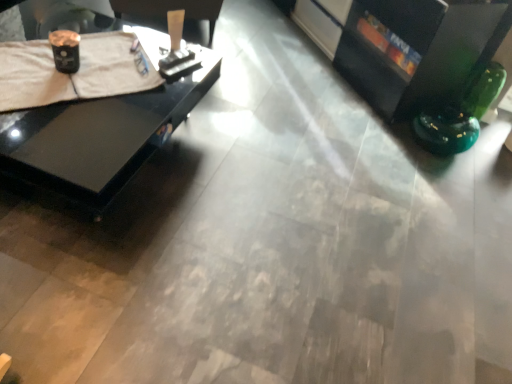
Find the location of a particular element. vacant area on top of black glossy table at left (from a real-world perspective) is located at coordinates 78,71.